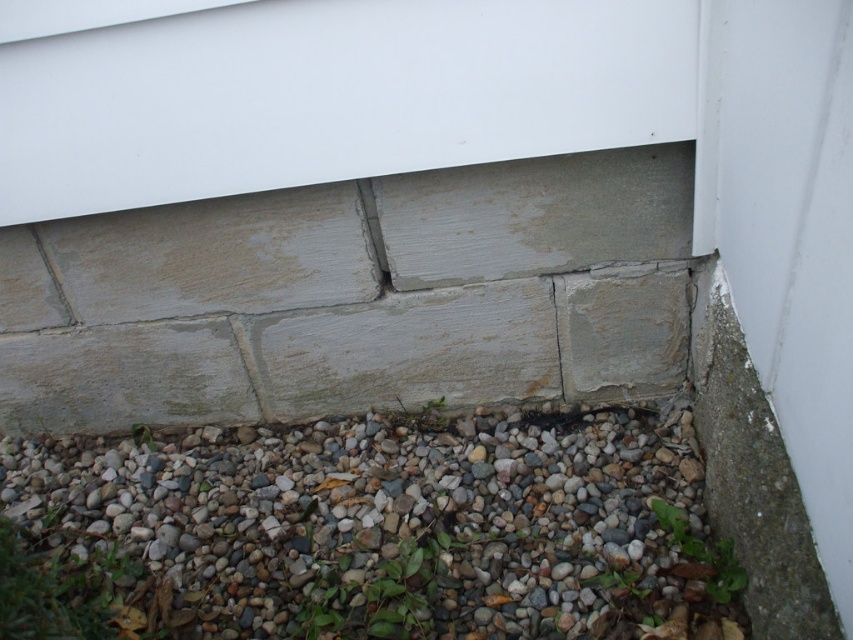
Who is shorter, gray gravel at lower center or gray concrete crack at lower left?

Standing shorter between the two is gray concrete crack at lower left.

Between point (514, 424) and point (41, 257), which one is positioned behind?

Positioned behind is point (514, 424).

Find the location of a particular element. This screenshot has height=640, width=853. gray gravel at lower center is located at coordinates (384, 531).